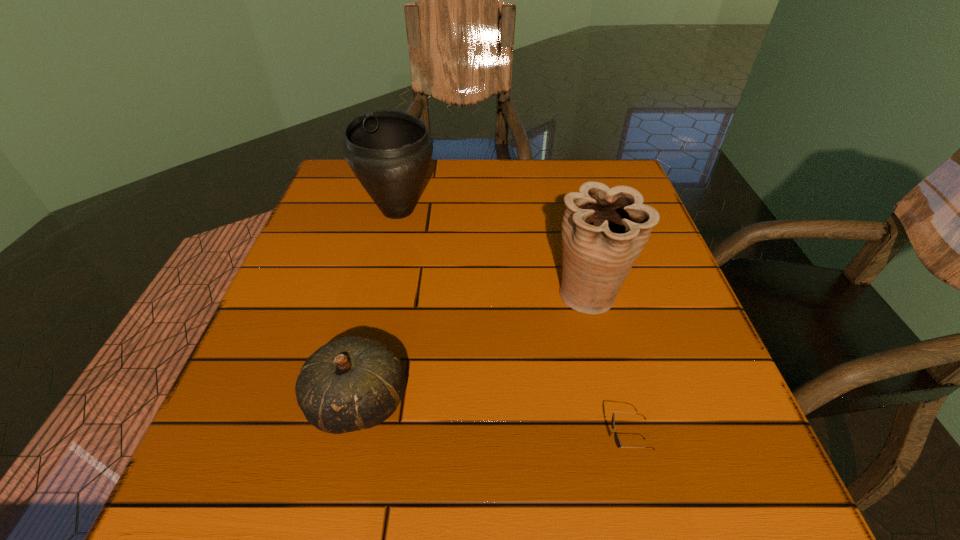
In the image, there is a desktop. What are the coordinates of `vacant space at the far edge` in the screenshot? It's located at (451, 158).

Locate an element on the screen. free region at the left edge of the desktop is located at coordinates (298, 325).

Where is `free space at the right edge of the desktop`? free space at the right edge of the desktop is located at coordinates (740, 454).

Locate an element on the screen. The image size is (960, 540). free space at the far left corner is located at coordinates (343, 161).

Where is `vacant space at the near left corner`? vacant space at the near left corner is located at coordinates (195, 505).

Locate an element on the screen. The image size is (960, 540). vacant space at the far right corner is located at coordinates (631, 187).

Locate an element on the screen. free area in between the sunglasses and the farther urn is located at coordinates (512, 328).

Where is `vacant space in between the left urn and the second shortest object`? The image size is (960, 540). vacant space in between the left urn and the second shortest object is located at coordinates (378, 306).

The width and height of the screenshot is (960, 540). Identify the location of free space between the second shortest object and the right urn. (474, 348).

The image size is (960, 540). Find the location of `blank region between the left urn and the shortest object`. blank region between the left urn and the shortest object is located at coordinates (512, 328).